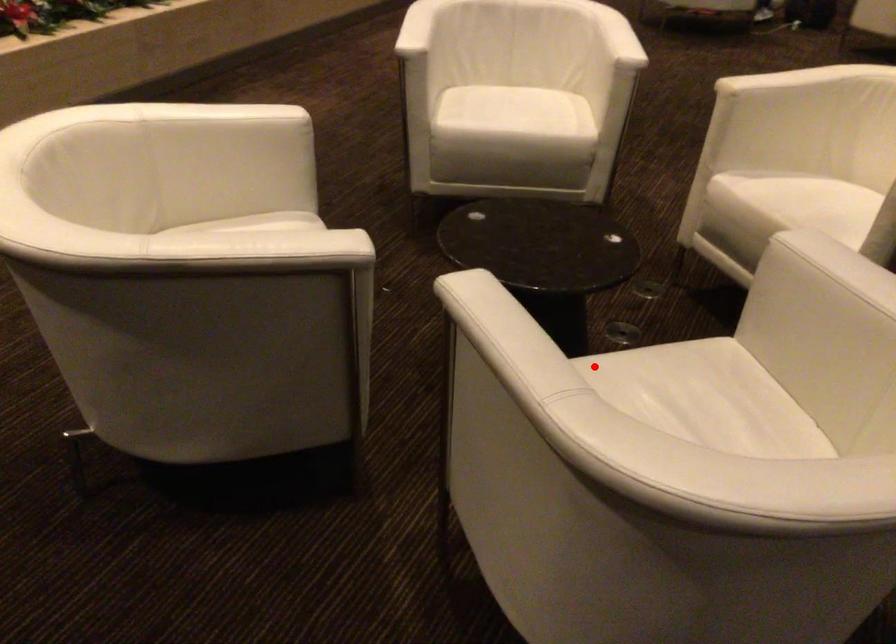
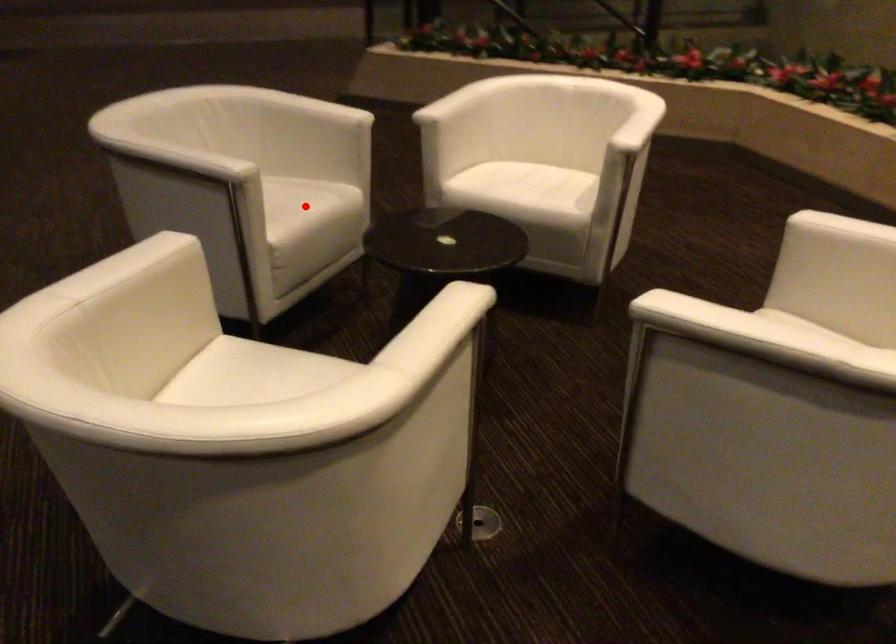
I am providing you with two images of the same scene from different viewpoints. A red point is marked on the first image and another point is marked on the second image. Is the marked point in image1 the same physical position as the marked point in image2?

Yes